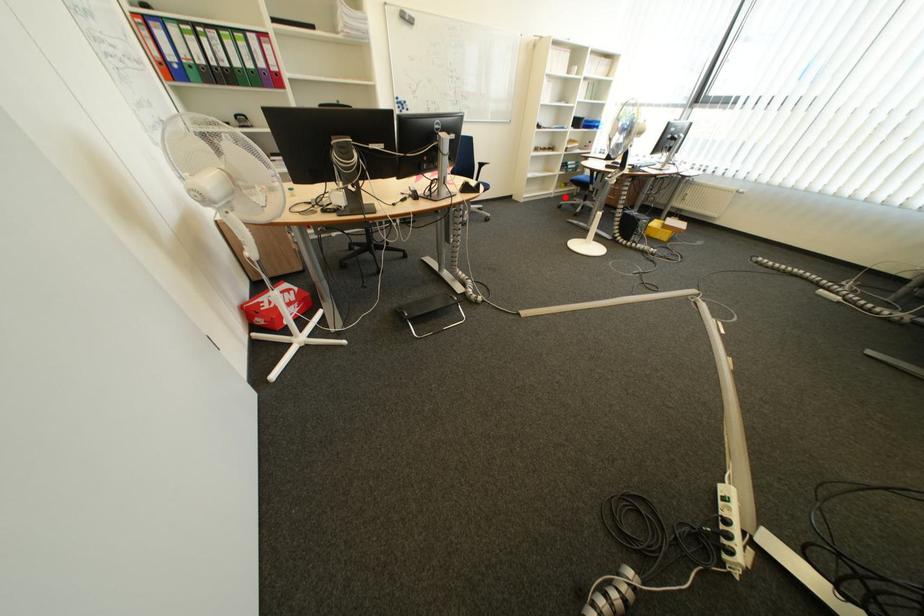
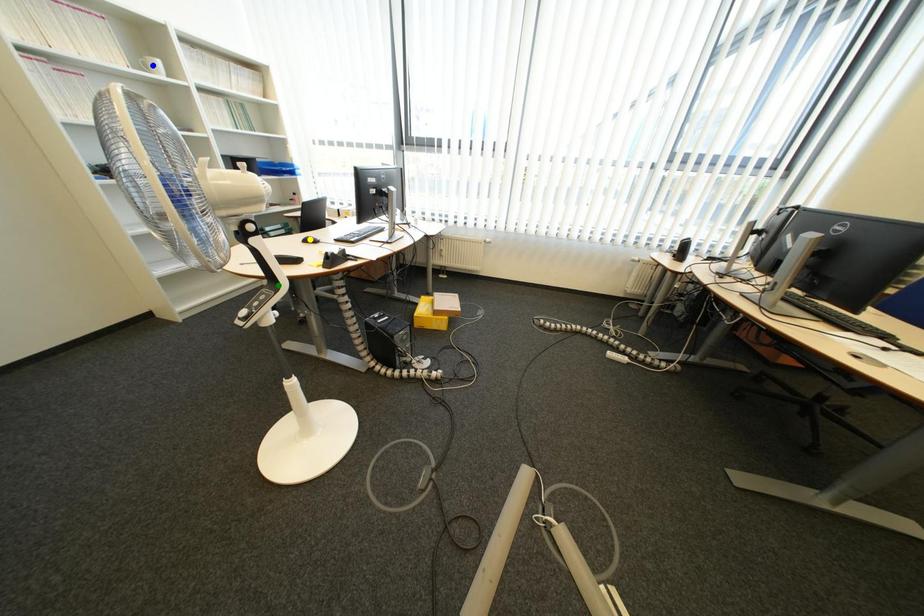
Question: I am providing you with two images of the same scene from different viewpoints. A red point is marked on the first image. You are given multiple points on the second image. Which spot in image 2 lines up with the point in image 1?

Choices:
 (A) yellow point
 (B) green point
 (C) blue point

Answer: (B)